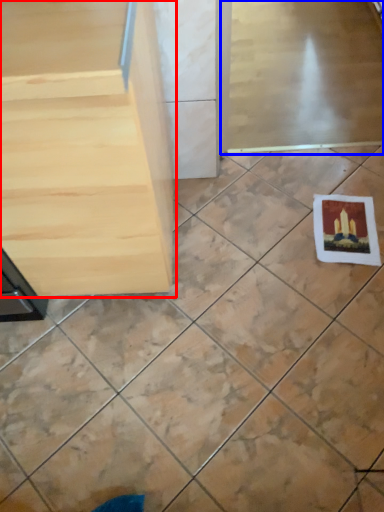
Question: Which point is further to the camera, furniture (highlighted by a red box) or screen door (highlighted by a blue box)?

Choices:
 (A) furniture
 (B) screen door

Answer: (B)